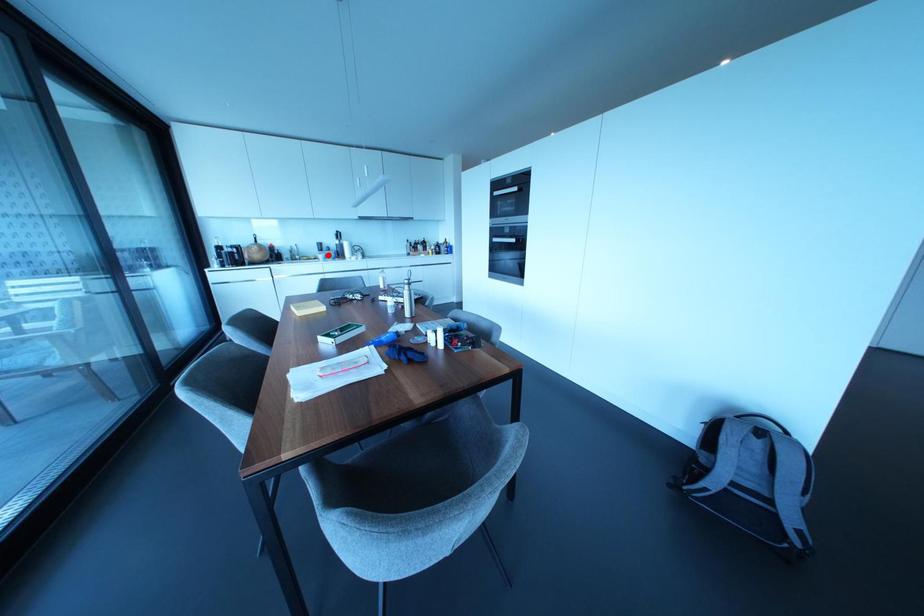
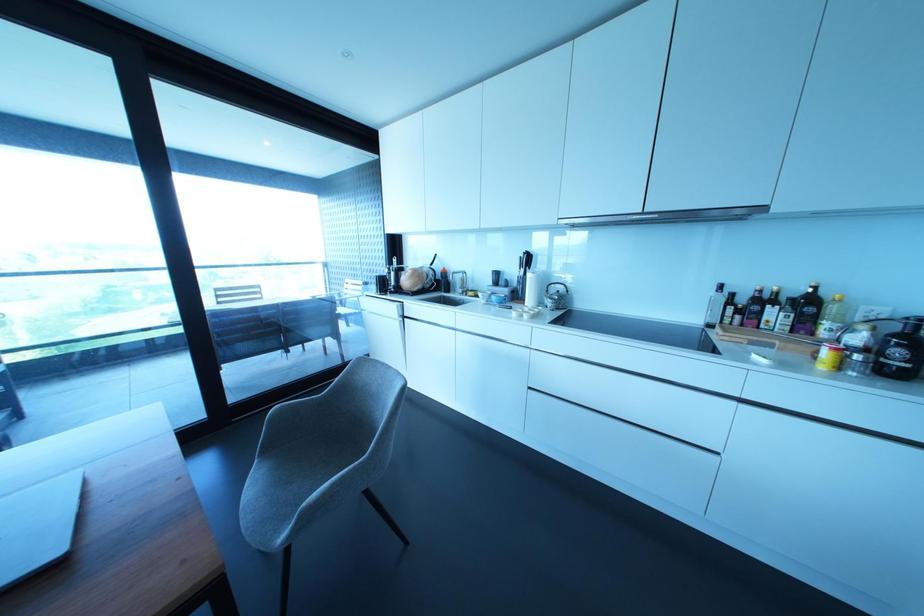
The point at the highlighted location is marked in the first image. Where is the corresponding point in the second image?

(492, 297)